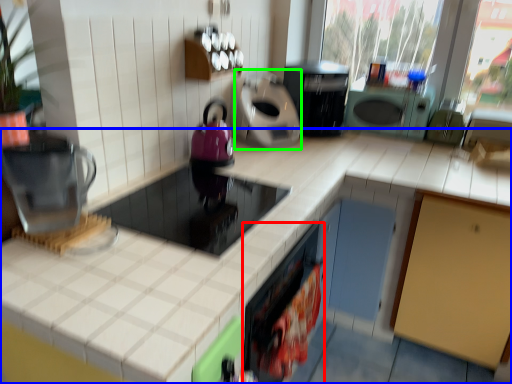
Question: Which is nearer to the appliance (highlighted by a red box)? countertop (highlighted by a blue box) or appliance (highlighted by a green box).

Choices:
 (A) countertop
 (B) appliance

Answer: (A)